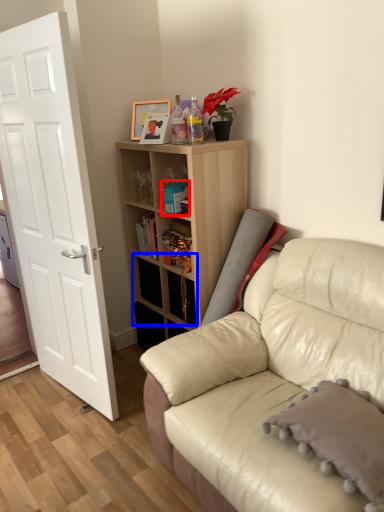
Question: Among these objects, which one is nearest to the camera, book (highlighted by a red box) or drawer (highlighted by a blue box)?

Choices:
 (A) book
 (B) drawer

Answer: (A)